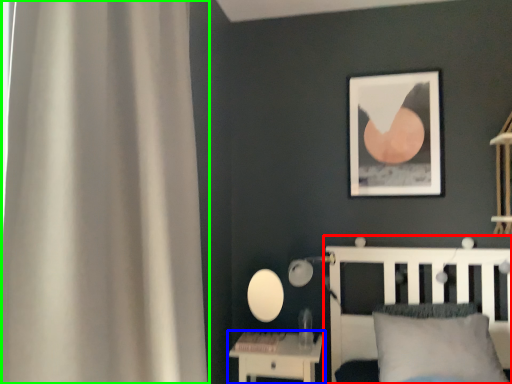
Question: Which object is positioned closest to bed (highlighted by a red box)? Select from nightstand (highlighted by a blue box) and curtain (highlighted by a green box).

Choices:
 (A) nightstand
 (B) curtain

Answer: (A)